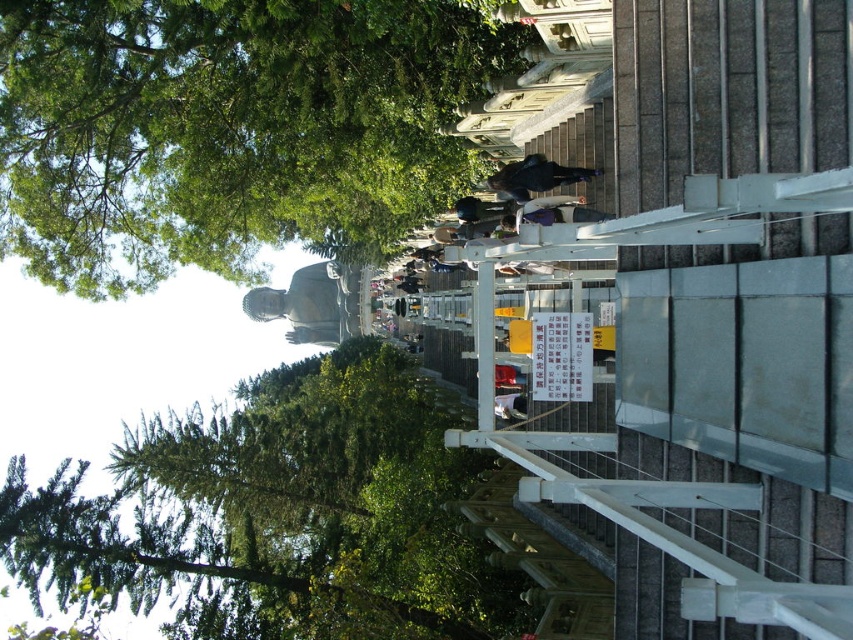
You are standing at the base of the stone steps leading up to the Buddha statue. You notice two points marked on the railings bordering the steps. The first point is at coordinate (251, 312) and the second point is at (498, 179). Which point is closer to your current position?

Point (251, 312) is further to the camera than point (498, 179), so the second point at (498, 179) is closer to your current position at the base of the steps.